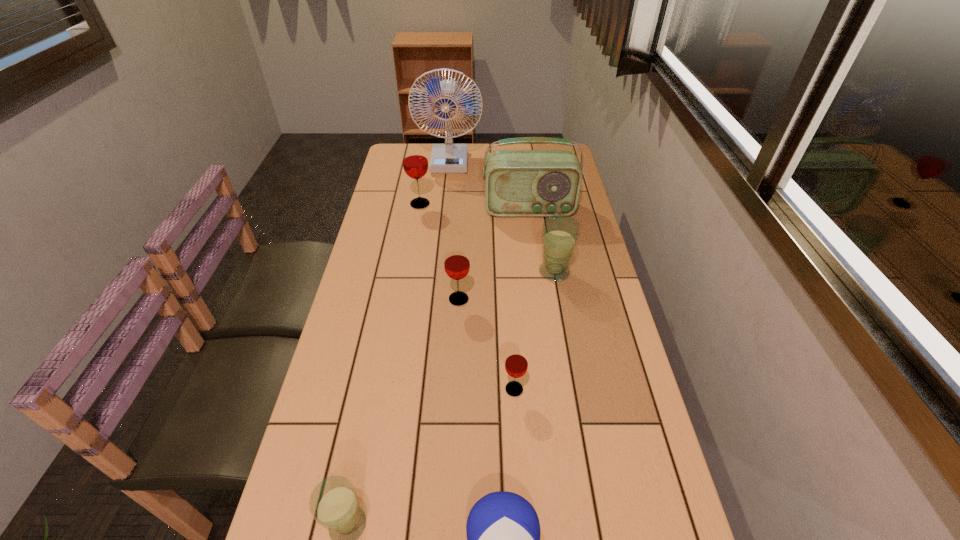
The height and width of the screenshot is (540, 960). I want to click on blank region between the farthest glass and the blue fan, so click(435, 183).

You are a GUI agent. You are given a task and a screenshot of the screen. Output one action in this format:
    pyautogui.click(x=<x>, y=<y>)
    Task: Click on the unoccupied position between the third tallest object and the seventh shortest object
    
    Given the screenshot: What is the action you would take?
    pyautogui.click(x=474, y=207)

Find the location of `free area in between the third nearest glass and the fourth nearest glass`. free area in between the third nearest glass and the fourth nearest glass is located at coordinates (507, 286).

You are a GUI agent. You are given a task and a screenshot of the screen. Output one action in this format:
    pyautogui.click(x=<x>, y=<y>)
    Task: Click on the object identified as the fourth closest to the shortest object
    The height and width of the screenshot is (540, 960).
    Given the screenshot: What is the action you would take?
    pyautogui.click(x=560, y=233)

Select which object appears as the third closest to the rightmost glass. Please provide its 2D coordinates. Your answer should be formatted as a tuple, i.e. [(x, y)], where the tuple contains the x and y coordinates of a point satisfying the conditions above.

[(516, 363)]

Identify which glass is the fourth nearest to the farthest red glass. Please provide its 2D coordinates. Your answer should be formatted as a tuple, i.e. [(x, y)], where the tuple contains the x and y coordinates of a point satisfying the conditions above.

[(334, 505)]

Select which glass is the fourth closest to the tallest glass. Please provide its 2D coordinates. Your answer should be formatted as a tuple, i.e. [(x, y)], where the tuple contains the x and y coordinates of a point satisfying the conditions above.

[(334, 505)]

Identify which red glass is located as the third nearest to the blue fan. Please provide its 2D coordinates. Your answer should be formatted as a tuple, i.e. [(x, y)], where the tuple contains the x and y coordinates of a point satisfying the conditions above.

[(516, 363)]

Point out which red glass is positioned as the nearest to the second smallest red glass. Please provide its 2D coordinates. Your answer should be formatted as a tuple, i.e. [(x, y)], where the tuple contains the x and y coordinates of a point satisfying the conditions above.

[(516, 363)]

Where is `vacant point that satisfies the following two spatial constraints: 1. on the front-facing side of the second biggest red glass; 2. on the right side of the fan`? vacant point that satisfies the following two spatial constraints: 1. on the front-facing side of the second biggest red glass; 2. on the right side of the fan is located at coordinates (436, 299).